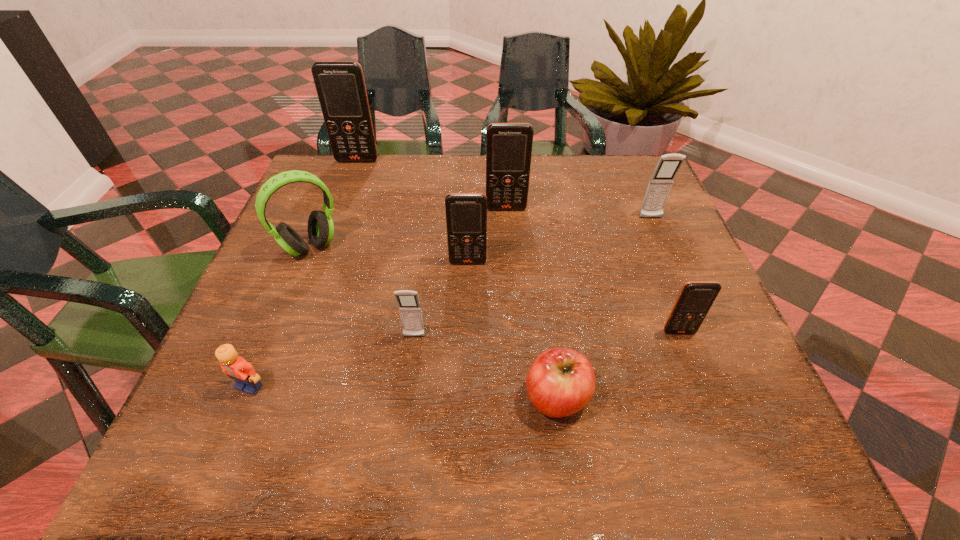
Where is `free location located on the screen of the nearest orange cellular telephone`? This screenshot has height=540, width=960. free location located on the screen of the nearest orange cellular telephone is located at coordinates (732, 466).

Where is `blank area located 0.080m on the front-facing side of the nearer gray cellular telephone`? This screenshot has height=540, width=960. blank area located 0.080m on the front-facing side of the nearer gray cellular telephone is located at coordinates (409, 379).

Locate an element on the screen. This screenshot has width=960, height=540. free spot located on the front-facing side of the Lego is located at coordinates (227, 443).

Where is `vacant space positioned on the right of the apple`? The image size is (960, 540). vacant space positioned on the right of the apple is located at coordinates (740, 398).

Where is `object that is at the near edge`? The height and width of the screenshot is (540, 960). object that is at the near edge is located at coordinates (561, 381).

The height and width of the screenshot is (540, 960). I want to click on cellular telephone that is positioned at the left edge, so click(340, 85).

The height and width of the screenshot is (540, 960). What are the coordinates of `headset that is positioned at the left edge` in the screenshot? It's located at [x=320, y=225].

Locate an element on the screen. This screenshot has width=960, height=540. Lego that is at the left edge is located at coordinates (242, 372).

The width and height of the screenshot is (960, 540). Find the location of `object that is at the far left corner`. object that is at the far left corner is located at coordinates [x=340, y=85].

At what (x,y) coordinates should I click in order to perform the action: click on vacant space at the far edge. Please return your answer as a coordinate pair (x, y). Looking at the image, I should click on tap(574, 181).